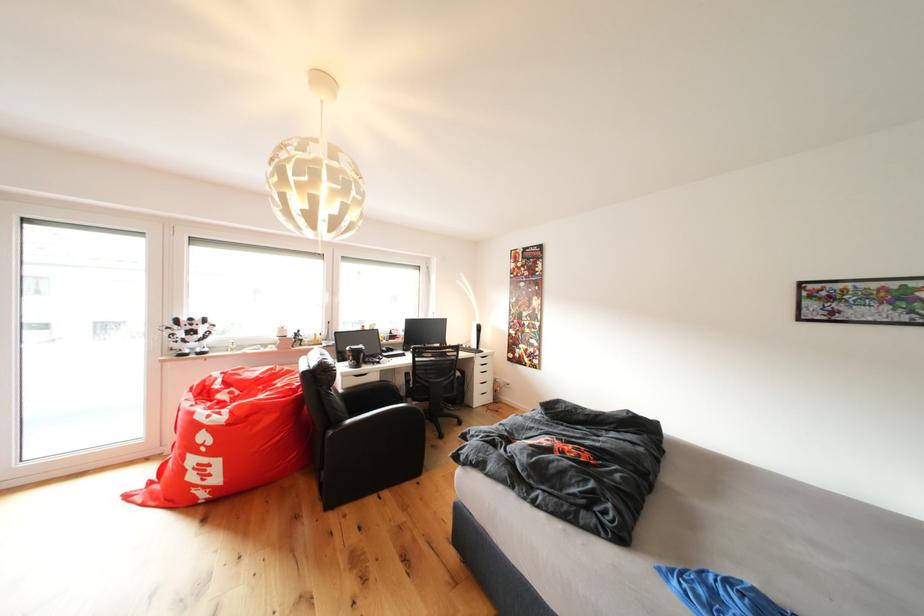
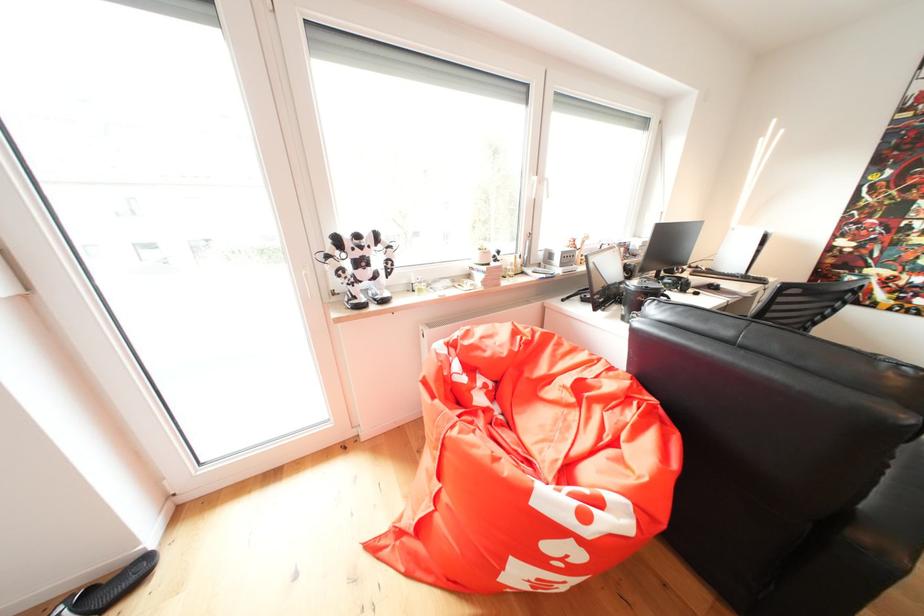
What movement of the cameraman would produce the second image?

The movement direction of the cameraman is left, forward.